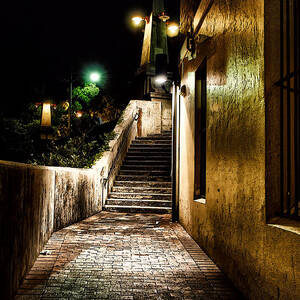
Where is `yellow lights`? yellow lights is located at coordinates (138, 20), (174, 29), (79, 114).